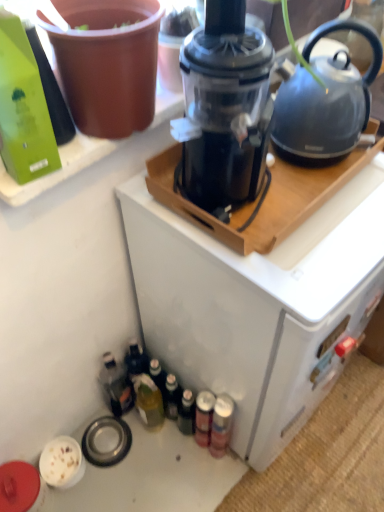
Locate an element on the screen. Image resolution: width=384 pixels, height=512 pixels. empty space that is to the right of translucent glass bottle at lower left, which is counted as the 2th bottle, starting from the back is located at coordinates (195, 452).